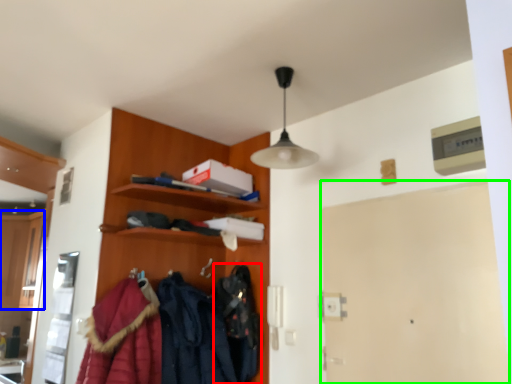
Question: Which object is positioned farthest from clothing (highlighted by a red box)? Select from cabinetry (highlighted by a blue box) and door (highlighted by a green box).

Choices:
 (A) cabinetry
 (B) door

Answer: (A)